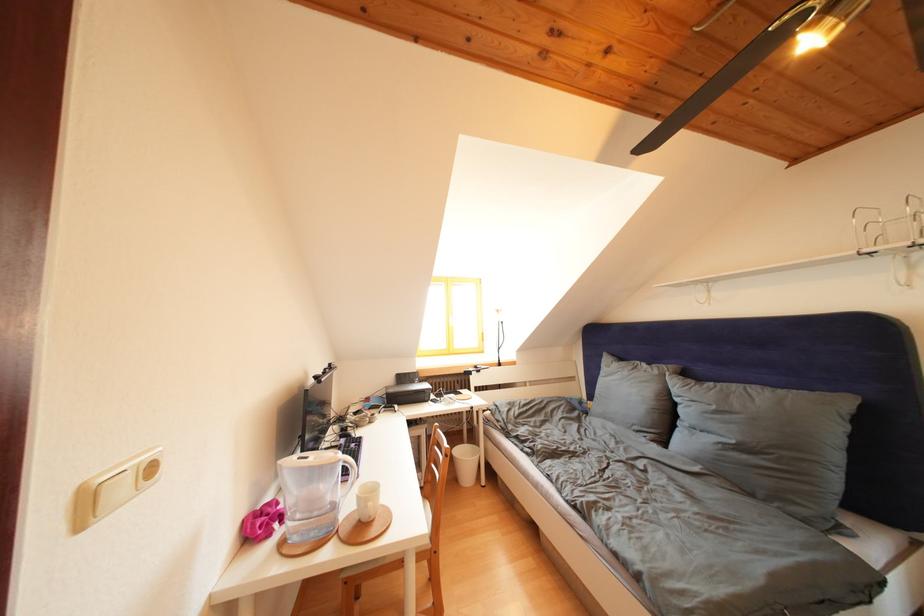
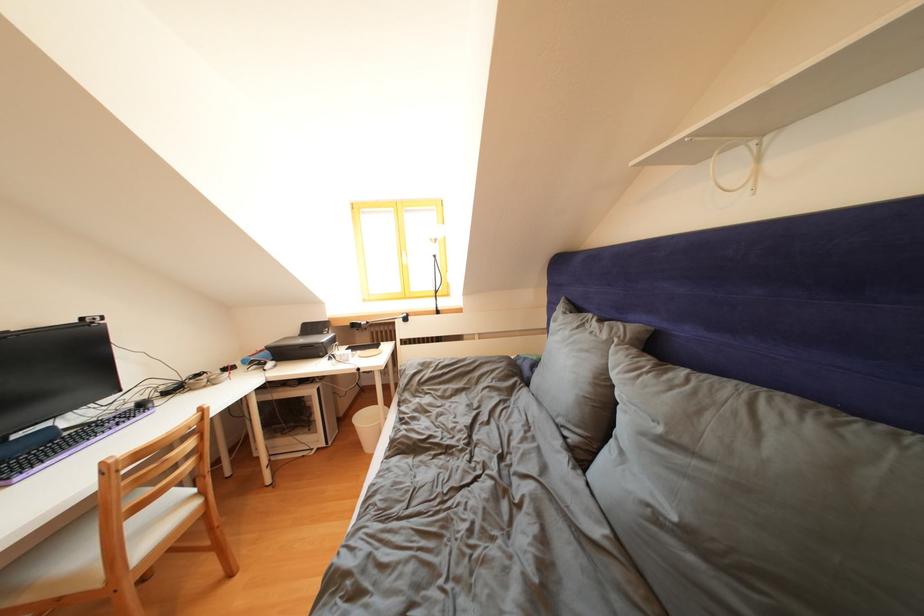
Locate, in the second image, the point that corresponds to point (722, 411) in the first image.

(667, 435)